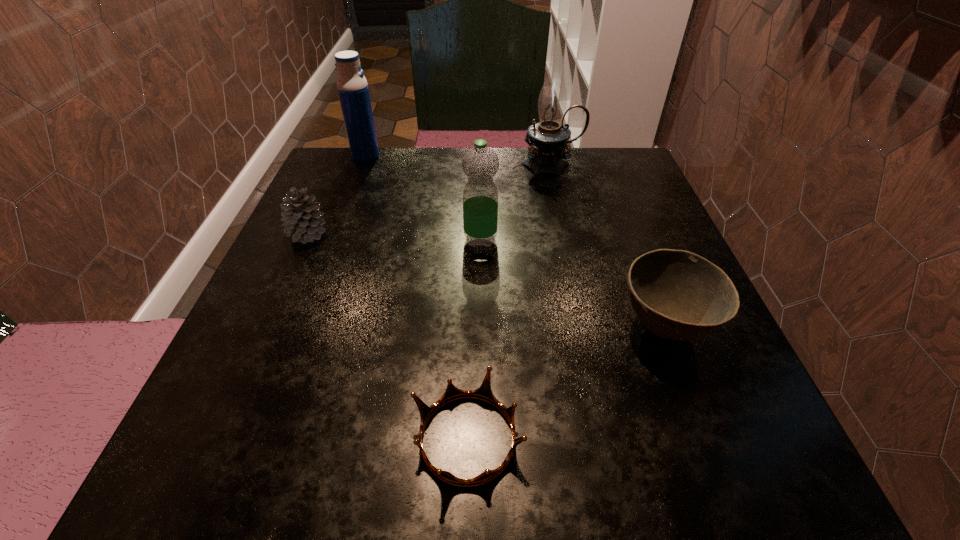
Locate an element on the screen. This screenshot has height=540, width=960. bowl positioned at the right edge is located at coordinates (678, 295).

At what (x,y) coordinates should I click in order to perform the action: click on object positioned at the far left corner. Please return your answer as a coordinate pair (x, y). Looking at the image, I should click on tap(352, 86).

I want to click on object situated at the far right corner, so click(x=548, y=139).

Find the location of a particular element. This screenshot has height=540, width=960. free spot at the far edge of the desktop is located at coordinates (442, 172).

Locate an element on the screen. vacant area at the near edge is located at coordinates (447, 446).

Identify the location of vacant region at the left edge of the desktop. Image resolution: width=960 pixels, height=540 pixels. (255, 387).

In the image, there is a desktop. Where is `vacant space at the right edge`? The width and height of the screenshot is (960, 540). vacant space at the right edge is located at coordinates (673, 237).

Image resolution: width=960 pixels, height=540 pixels. Find the location of `blank space at the far left corner of the desktop`. blank space at the far left corner of the desktop is located at coordinates (329, 190).

Locate an element on the screen. This screenshot has height=540, width=960. vacant space at the near left corner is located at coordinates (263, 467).

Find the location of a particular element. free space at the near right corner of the desktop is located at coordinates (678, 433).